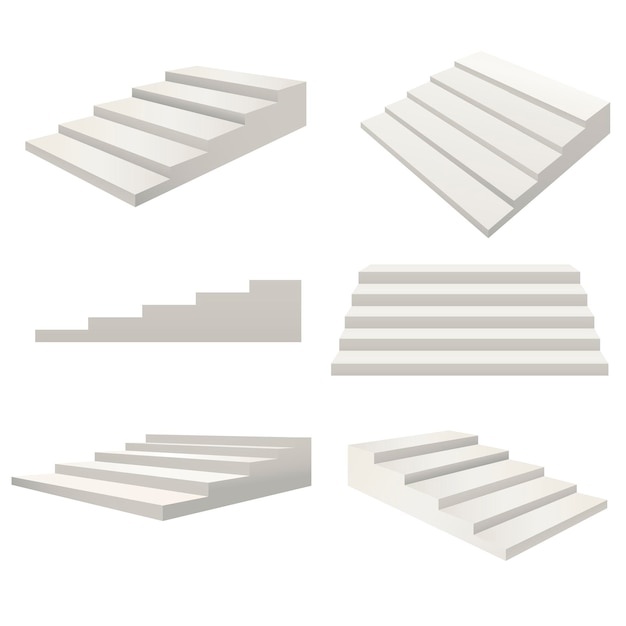
Identify the location of stairs. (182, 491), (458, 488), (467, 307), (228, 332), (156, 131), (439, 126).